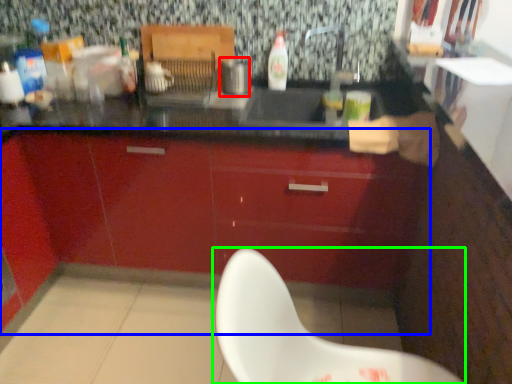
Question: Which is nearer to the appliance (highlighted by a red box)? cabinetry (highlighted by a blue box) or chair (highlighted by a green box).

Choices:
 (A) cabinetry
 (B) chair

Answer: (A)